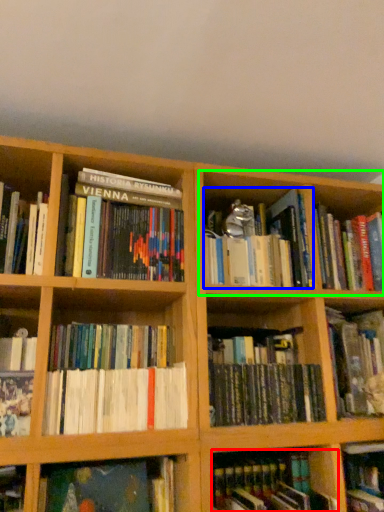
Question: Which object is positioned closest to book (highlighted by a red box)? Select from book (highlighted by a blue box) and cabinet (highlighted by a green box).

Choices:
 (A) book
 (B) cabinet

Answer: (A)